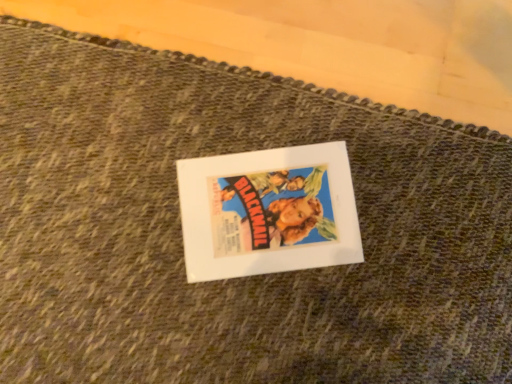
You are a GUI agent. You are given a task and a screenshot of the screen. Output one action in this format:
    pyautogui.click(x=<x>, y=<y>)
    Task: Click on the vacant area that is in front of white paper at center
    This screenshot has height=384, width=512.
    Given the screenshot: What is the action you would take?
    pyautogui.click(x=296, y=327)